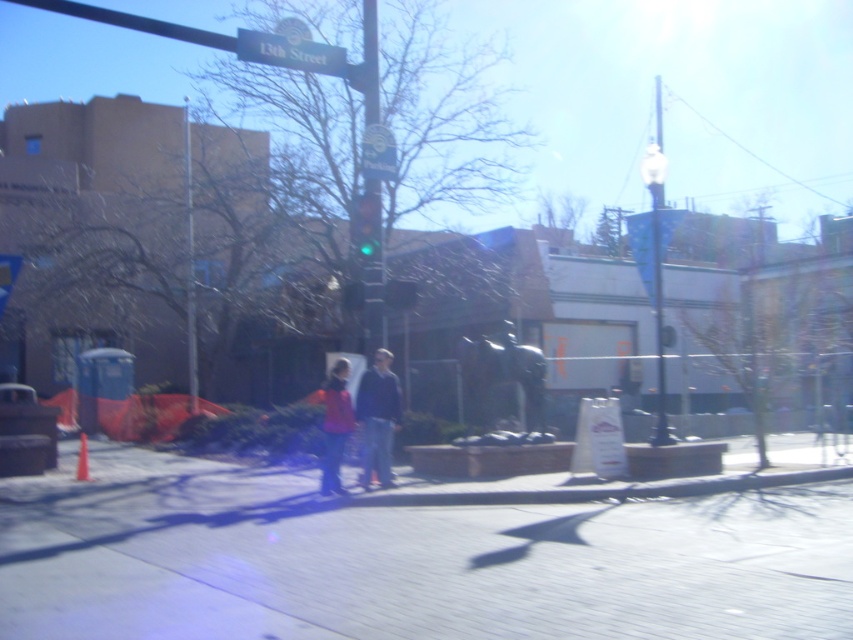
You are a pedestrian standing on the sidewalk and want to cross the street. The traffic light you need to look at is the green glass traffic light at center. Where is it located in the image?

The green glass traffic light at center is located at the coordinates point (364, 225) in the image.

You are a delivery person needing to place a 4 meter long ladder between the green plastic street sign at upper center and the green glass traffic light at center. Can the ladder fit between them without overlapping either object?

The distance between the green plastic street sign at upper center and the green glass traffic light at center is 3.91 meters. Since the ladder is 4 meters long, it is slightly longer than the space available, so the ladder cannot fit between them without overlapping one of the objects.